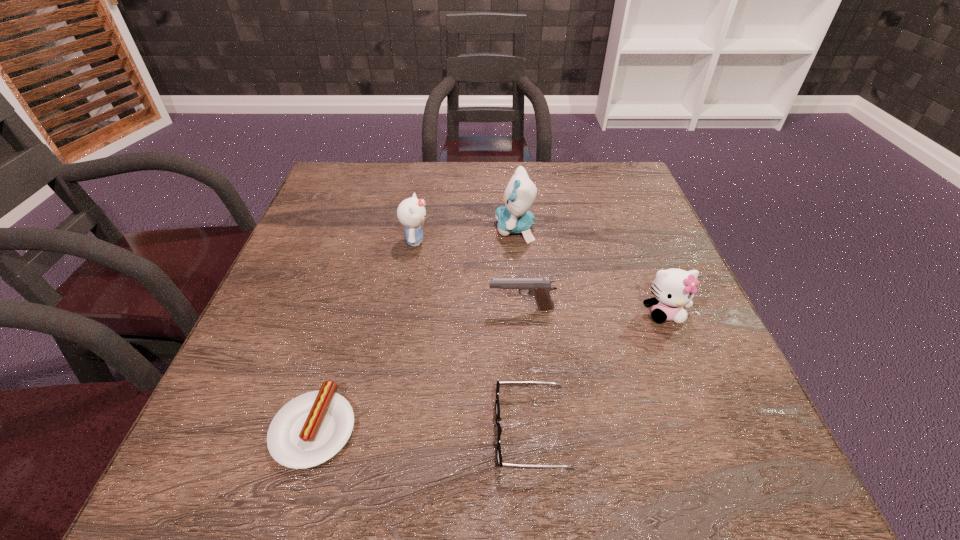
You are a GUI agent. You are given a task and a screenshot of the screen. Output one action in this format:
    pyautogui.click(x=<x>, y=<y>)
    Task: Click on the vacant space that's between the leftmost object and the third shortest object
    This screenshot has width=960, height=540.
    Given the screenshot: What is the action you would take?
    pyautogui.click(x=418, y=368)

Select which object is the closest to the pistol. Please provide its 2D coordinates. Your answer should be formatted as a tuple, i.e. [(x, y)], where the tuple contains the x and y coordinates of a point satisfying the conditions above.

[(673, 288)]

Identify the location of the closest object relative to the fourth tallest object. This screenshot has width=960, height=540. [x=673, y=288].

This screenshot has height=540, width=960. What are the coordinates of `kitten that is the closest to the second kitten from right to left` in the screenshot? It's located at (411, 212).

Find the location of a particular element. Image resolution: width=960 pixels, height=540 pixels. the closest kitten to the fourth tallest object is located at coordinates (673, 288).

Where is `free space that satisfies the following two spatial constraints: 1. on the front-facing side of the leftmost kitten; 2. on the front side of the sausage`? Image resolution: width=960 pixels, height=540 pixels. free space that satisfies the following two spatial constraints: 1. on the front-facing side of the leftmost kitten; 2. on the front side of the sausage is located at coordinates (384, 428).

Identify the location of vacant area in the image that satisfies the following two spatial constraints: 1. at the barrel of the fourth tallest object; 2. on the front side of the shortest object. (533, 428).

Find the location of a particular element. vacant space that satisfies the following two spatial constraints: 1. on the front-facing side of the fifth object from right to left; 2. on the front side of the shortest object is located at coordinates (384, 428).